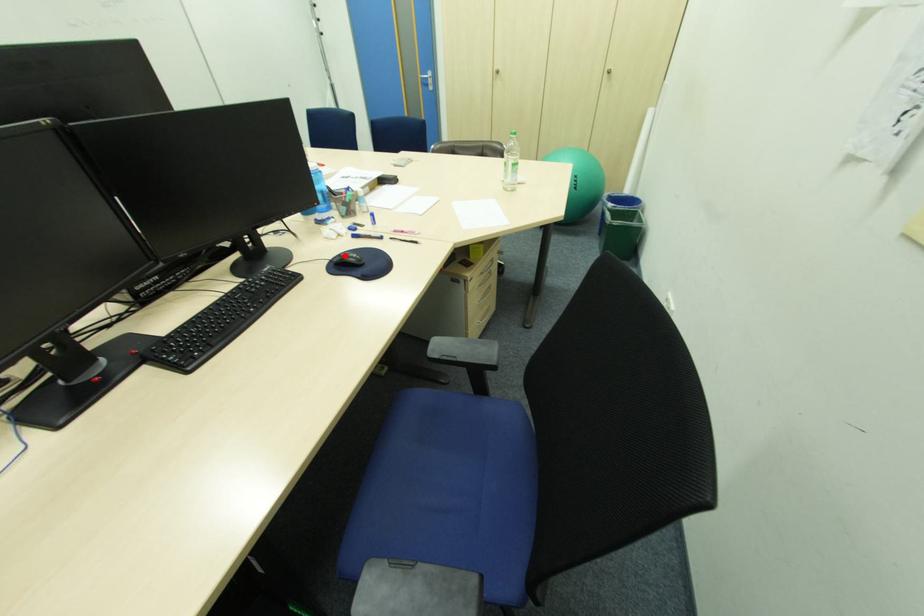
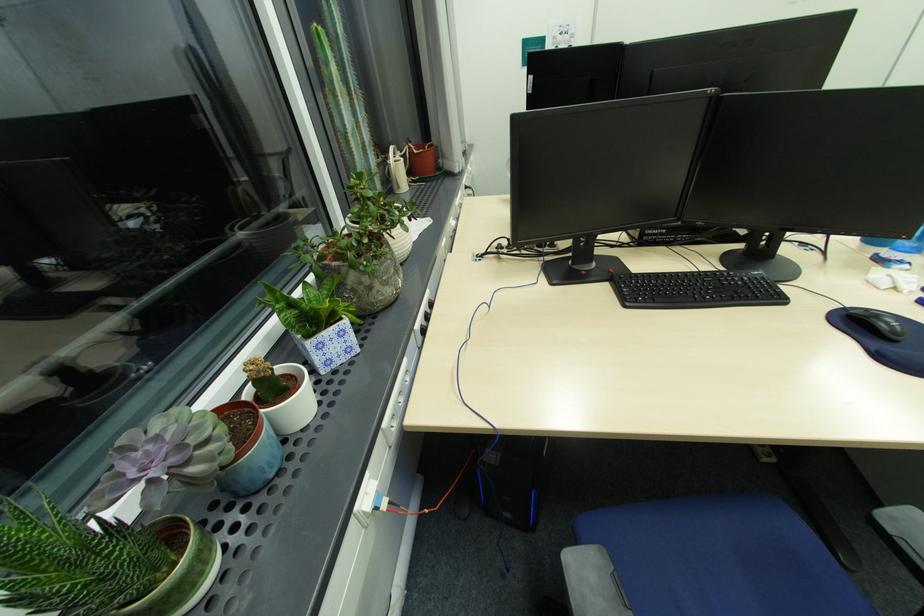
Locate, in the second image, the point that corresponds to the highlighted location in the first image.

(872, 310)